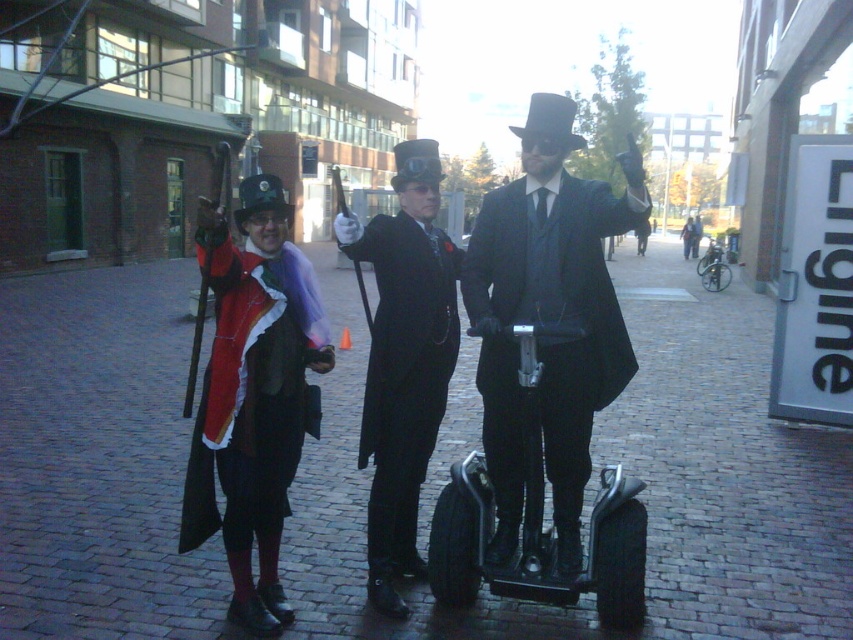
Question: Can you confirm if velvet red coat at left is positioned below metallic silver scooter at center?

Choices:
 (A) yes
 (B) no

Answer: (B)

Question: Which point is closer to the camera taking this photo?

Choices:
 (A) (289, 384)
 (B) (582, 253)

Answer: (B)

Question: Among these objects, which one is farthest from the camera?

Choices:
 (A) matte black suit at center
 (B) black glossy suit at center
 (C) velvet red coat at left
 (D) metallic silver scooter at center

Answer: (B)

Question: From the image, what is the correct spatial relationship of matte black suit at center in relation to metallic silver scooter at center?

Choices:
 (A) below
 (B) above

Answer: (B)

Question: Is matte black suit at center closer to the viewer compared to black glossy suit at center?

Choices:
 (A) no
 (B) yes

Answer: (B)

Question: Among these objects, which one is nearest to the camera?

Choices:
 (A) black glossy suit at center
 (B) matte black suit at center
 (C) velvet red coat at left

Answer: (B)